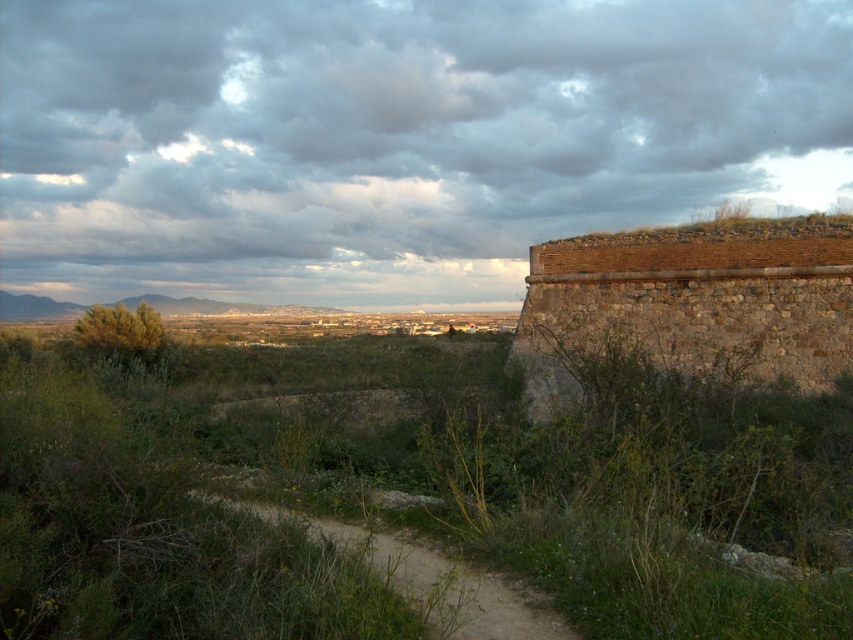
Can you confirm if brown stone wall at right is positioned to the right of dirt path at center?

Indeed, brown stone wall at right is positioned on the right side of dirt path at center.

Can you confirm if brown stone wall at right is smaller than dirt path at center?

No.

Where is `brown stone wall at right`? This screenshot has width=853, height=640. brown stone wall at right is located at coordinates (693, 300).

Which of these two, dark gray cloud at upper center or dirt path at center, stands shorter?

dirt path at center

In the scene shown: Who is more forward, [206,131] or [451,605]?

Positioned in front is point [451,605].

Between point (631, 218) and point (444, 596), which one is positioned in front?

Point (444, 596) is in front.

In order to click on dark gray cloud at upper center in this screenshot , I will do `click(395, 131)`.

Between dark gray cloud at upper center and brown stone wall at right, which one appears on the left side from the viewer's perspective?

dark gray cloud at upper center

Which is in front, point (339, 244) or point (612, 326)?

Point (612, 326) is in front.

Identify the location of dark gray cloud at upper center. (395, 131).